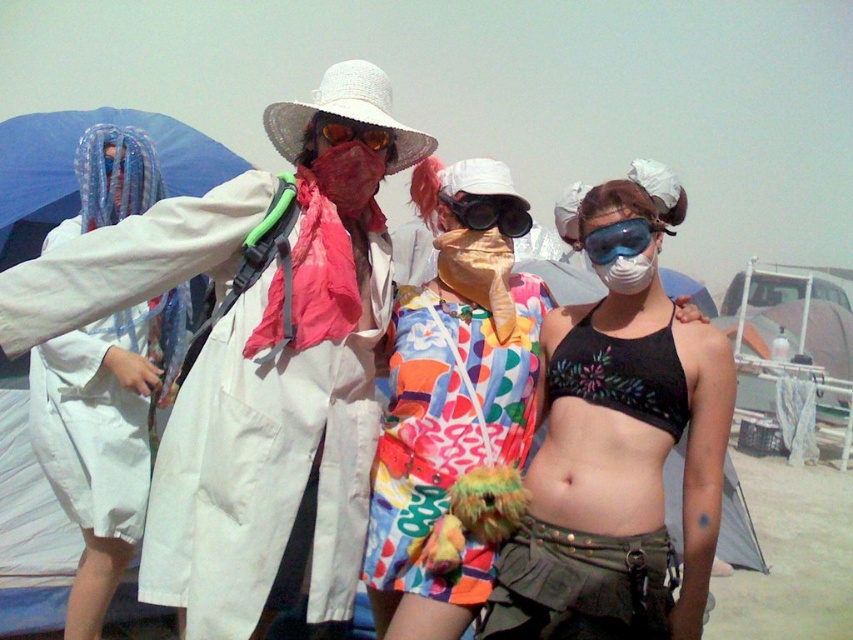
You are standing at the center of the image and want to locate the black plastic goggles. Which direction should you look to find the point at coordinates (488, 212)?

The point at coordinates (488, 212) is on the black plastic goggles at center, so you should look towards the center to find them.

You are trying to determine which item is bigger between the white cotton coat at center and the shiny orange goggles at center. Based on the scene, which one is larger?

The white cotton coat at center is larger in size than the shiny orange goggles at center.

You are a festival attendee who wants to take a photo of the shiny orange goggles at center without the black plastic goggles at center blocking the view. Is this possible?

The shiny orange goggles at center is behind the black plastic goggles at center, so it will be blocked from view. Move around to the other side of the black plastic goggles at center to get an unobstructed view.